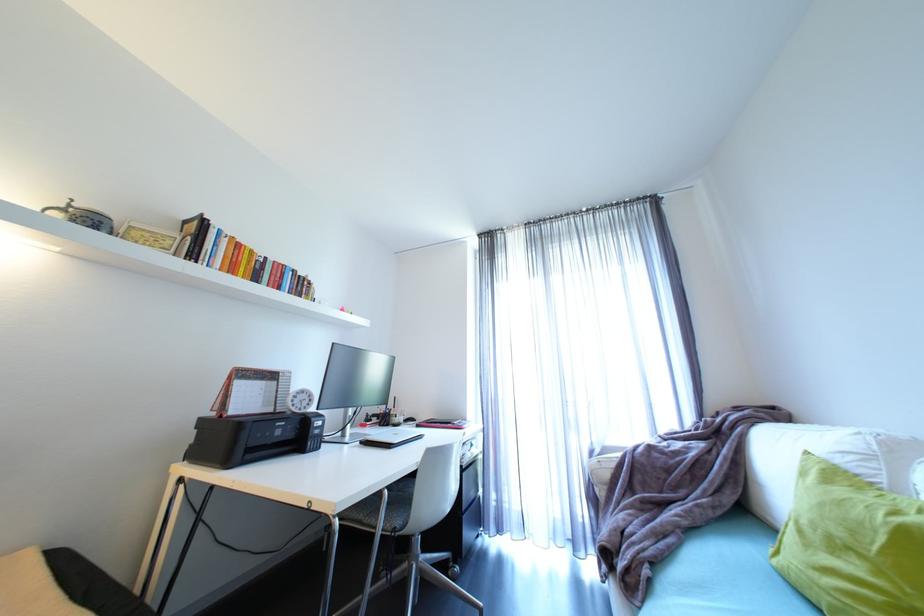
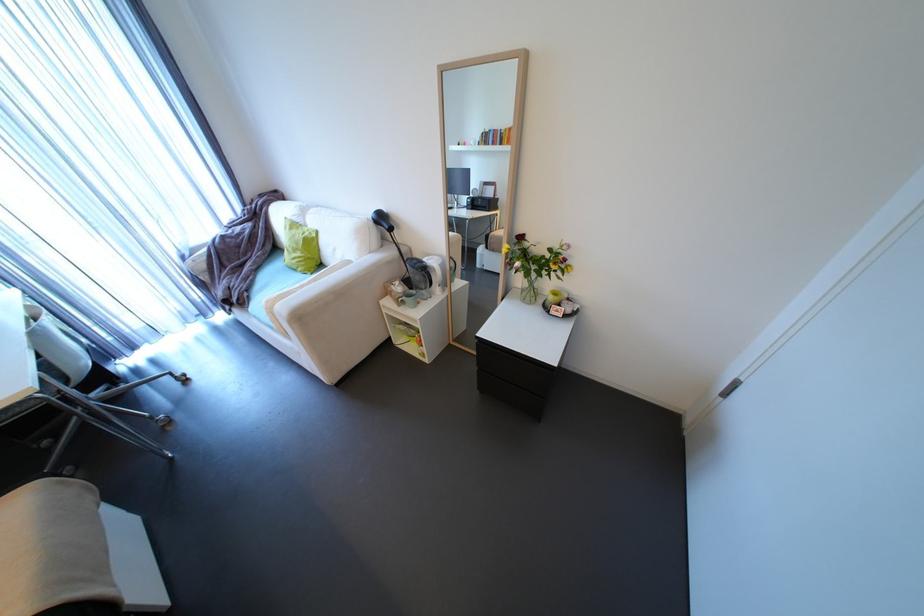
Find the pixel in the second image that matches pixel 604 451 in the first image.

(195, 254)